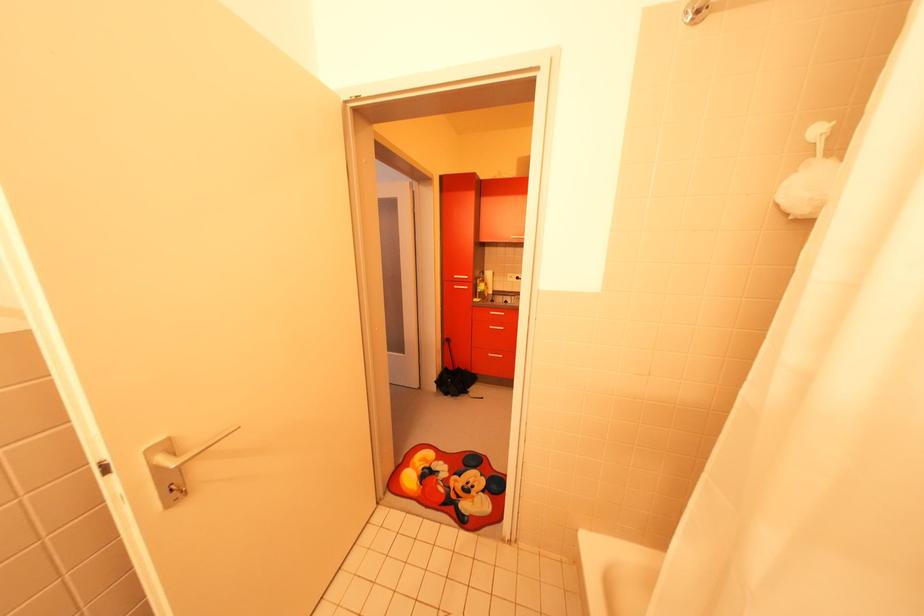
Describe the element at coordinates (696, 12) in the screenshot. The width and height of the screenshot is (924, 616). I see `the chrome shower head` at that location.